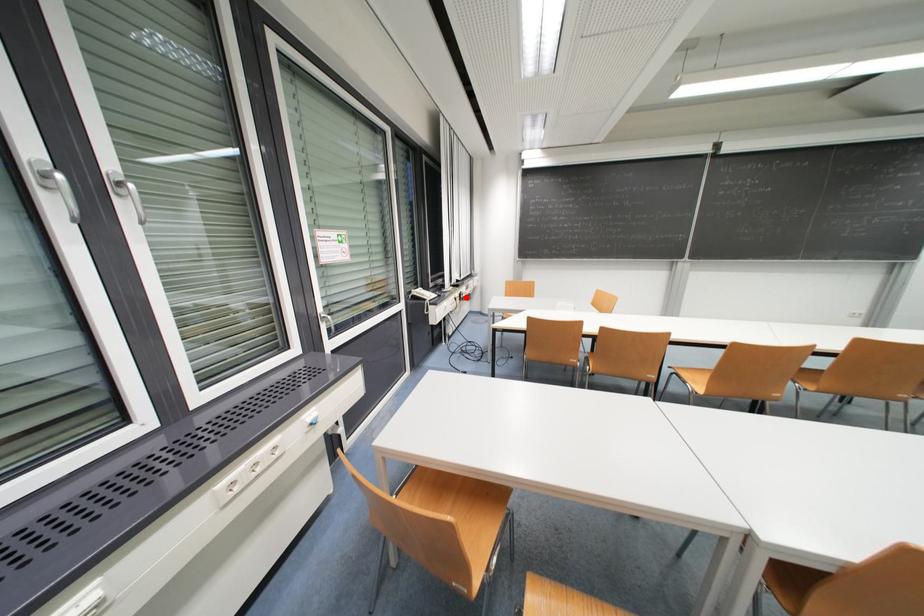
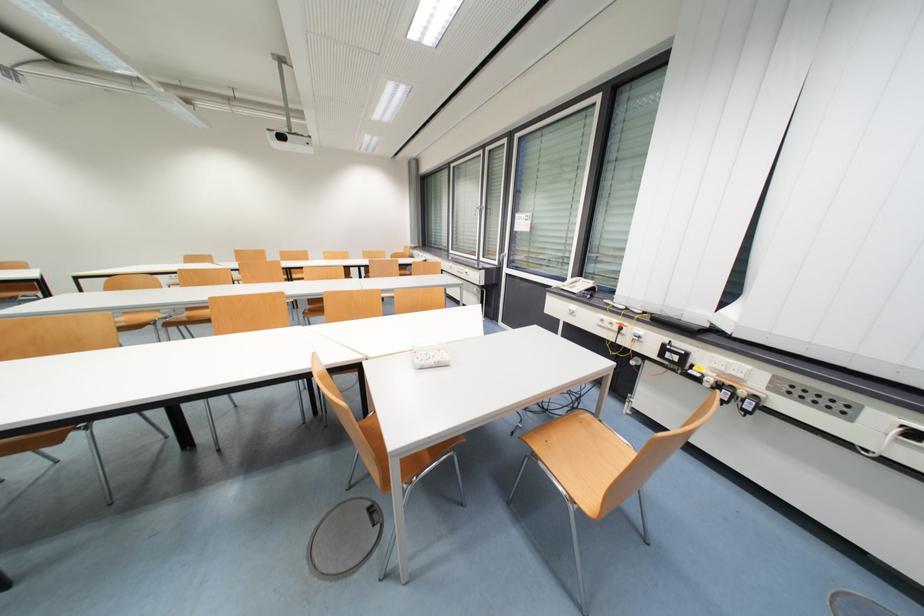
Find the pixel in the second image that matches the highlighted location in the first image.

(671, 350)